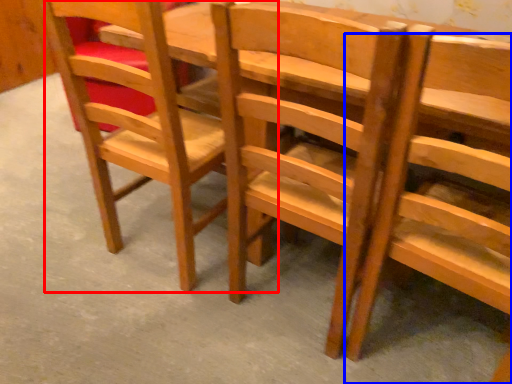
Question: Among these objects, which one is farthest to the camera, chair (highlighted by a red box) or chair (highlighted by a blue box)?

Choices:
 (A) chair
 (B) chair

Answer: (A)